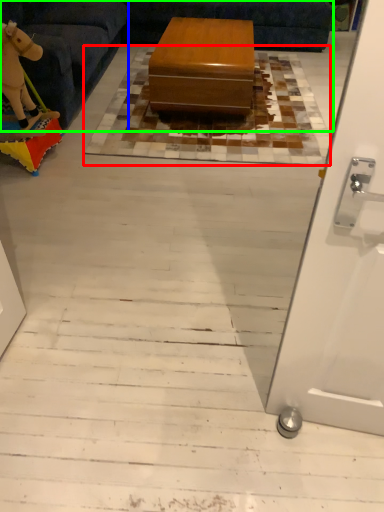
Question: Considering the real-world distances, which object is farthest from mat (highlighted by a red box)? furniture (highlighted by a blue box) or couch (highlighted by a green box)?

Choices:
 (A) furniture
 (B) couch

Answer: (B)